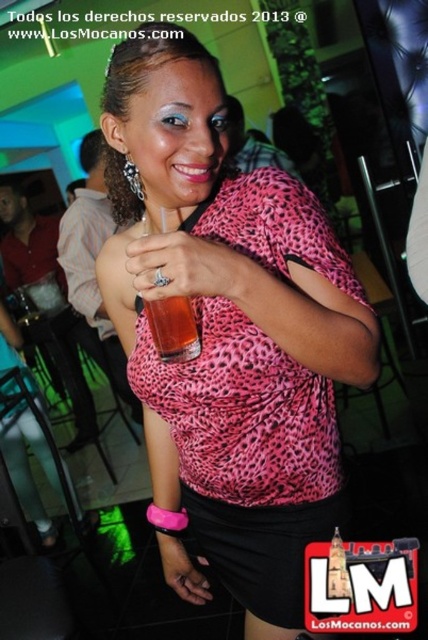
You are a photographer at the event and want to capture a photo of the woman in the pink leopard print blouse at center and the translucent plastic cup at center. Which item should you focus on first if you want to emphasize the woman more in the photo?

The pink leopard print blouse at center is positioned on the right side of the translucent plastic cup at center, so focusing on the woman in the pink leopard print blouse at center first would emphasize her more in the photo.

You are a photographer at the party and want to take a photo of the woman in the pink leopard print blouse at center and the translucent plastic cup at center. Which object should you focus on first if you want to capture both clearly in the same frame?

The pink leopard print blouse at center is below the translucent plastic cup at center, so you should focus on the translucent plastic cup at center first since it is closer to the camera.